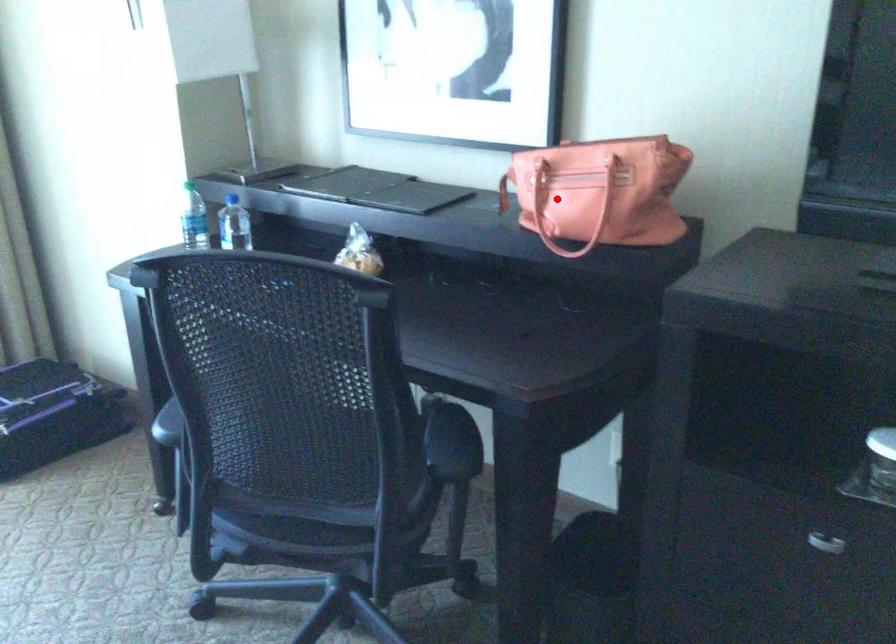
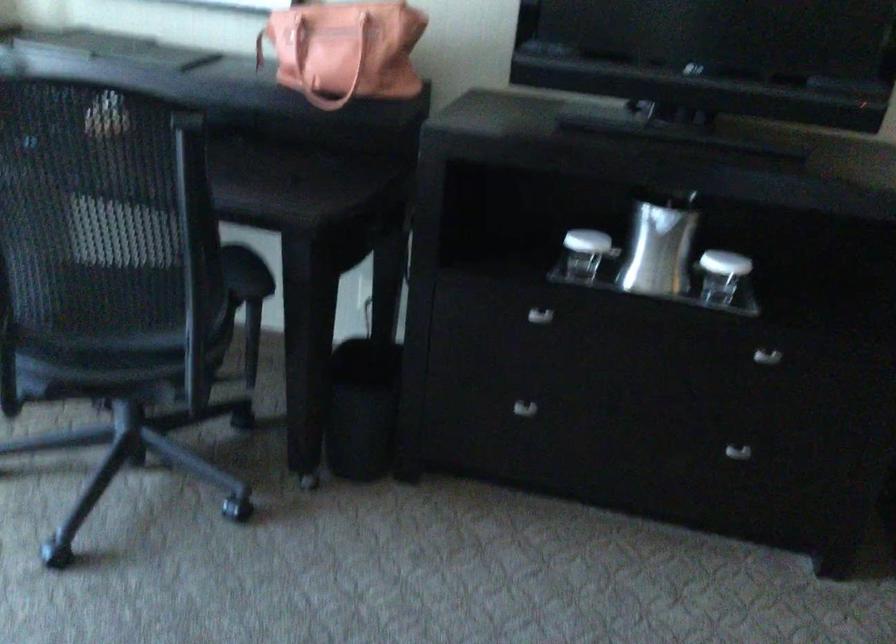
Locate, in the second image, the point that corresponds to the highlighted location in the first image.

(315, 57)